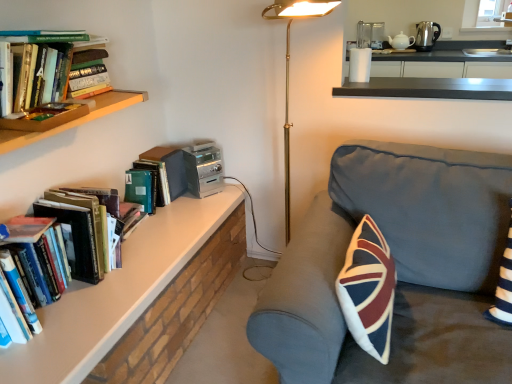
Question: From the image's perspective, is dark gray fabric couch at center above or below gold metallic floor lamp at center?

Choices:
 (A) below
 (B) above

Answer: (A)

Question: Is dark gray fabric couch at center in front of or behind gold metallic floor lamp at center in the image?

Choices:
 (A) front
 (B) behind

Answer: (A)

Question: Considering the real-world distances, which object is farthest from the white glossy counter at upper right?

Choices:
 (A) polished stainless steel kettle at upper right, placed as the first appliance when sorted from top to bottom
 (B) gold metallic floor lamp at center
 (C) dark gray fabric couch at center
 (D) white ceramic teapot at upper right, arranged as the 2th appliance when viewed from the top
 (E) silver metallic stereo at upper center, marked as the 1th appliance in a bottom-to-top arrangement

Answer: (C)

Question: Estimate the real-world distances between objects in this image. Which object is farther from the gold metallic floor lamp at center?

Choices:
 (A) white glossy counter at upper right
 (B) hardcover books at left, marked as the first book in a front-to-back arrangement
 (C) silver metallic stereo at upper center, the third appliance viewed from the top
 (D) hardcover books at left, which is counted as the 2th book, starting from the back
 (E) polished stainless steel kettle at upper right, which ranks as the 2th appliance in front-to-back order

Answer: (E)